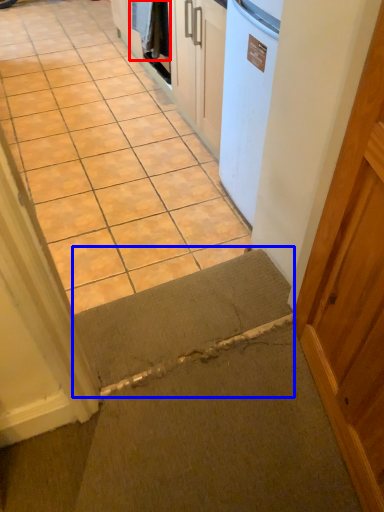
Question: Which object is further to the camera taking this photo, laundry (highlighted by a red box) or doormat (highlighted by a blue box)?

Choices:
 (A) laundry
 (B) doormat

Answer: (A)